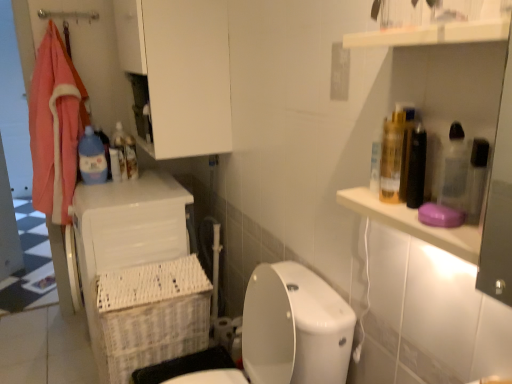
Question: Does white wicker basket at lower left have a greater height compared to blue plastic bottle at left?

Choices:
 (A) yes
 (B) no

Answer: (A)

Question: Could you tell me if white wicker basket at lower left is turned towards blue plastic bottle at left?

Choices:
 (A) no
 (B) yes

Answer: (A)

Question: From the image's perspective, is white wicker basket at lower left on top of blue plastic bottle at left?

Choices:
 (A) yes
 (B) no

Answer: (B)

Question: Considering the relative sizes of white wicker basket at lower left and blue plastic bottle at left in the image provided, is white wicker basket at lower left smaller than blue plastic bottle at left?

Choices:
 (A) yes
 (B) no

Answer: (B)

Question: From a real-world perspective, is white wicker basket at lower left physically above blue plastic bottle at left?

Choices:
 (A) yes
 (B) no

Answer: (B)

Question: Is white wicker basket at lower left next to blue plastic bottle at left?

Choices:
 (A) yes
 (B) no

Answer: (B)

Question: From a real-world perspective, does white wicker basket at lower left sit lower than blue plastic bottle at upper left?

Choices:
 (A) yes
 (B) no

Answer: (A)

Question: Does white wicker basket at lower left have a larger size compared to blue plastic bottle at upper left?

Choices:
 (A) no
 (B) yes

Answer: (B)

Question: Does white wicker basket at lower left come behind blue plastic bottle at upper left?

Choices:
 (A) no
 (B) yes

Answer: (A)

Question: Is white wicker basket at lower left facing away from blue plastic bottle at upper left?

Choices:
 (A) yes
 (B) no

Answer: (B)

Question: Is white wicker basket at lower left positioned far away from blue plastic bottle at upper left?

Choices:
 (A) yes
 (B) no

Answer: (B)

Question: Is white wicker basket at lower left to the left of blue plastic bottle at upper left from the viewer's perspective?

Choices:
 (A) yes
 (B) no

Answer: (B)

Question: Can you confirm if white plastic laundry basket at lower left is wider than blue plastic bottle at left?

Choices:
 (A) no
 (B) yes

Answer: (B)